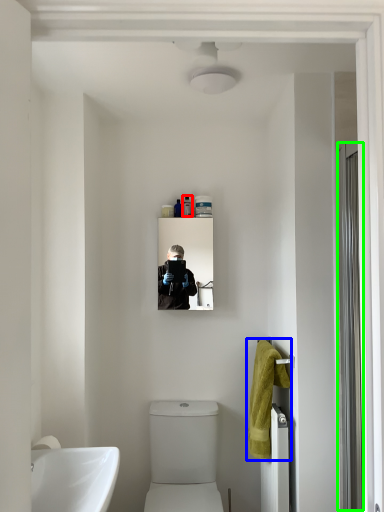
Question: Considering the real-world distances, which object is farthest from toiletry (highlighted by a red box)? bath towel (highlighted by a blue box) or screen door (highlighted by a green box)?

Choices:
 (A) bath towel
 (B) screen door

Answer: (B)